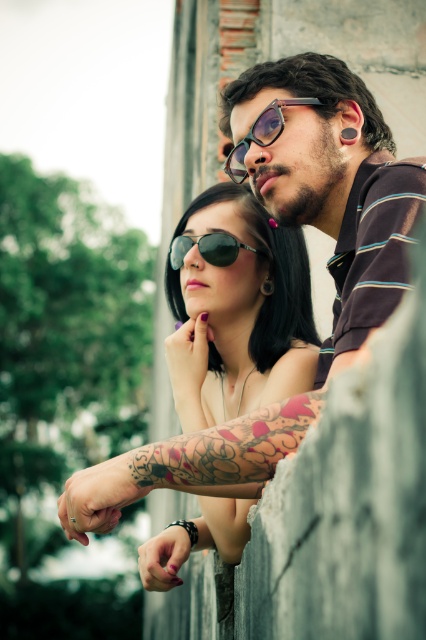
Between matte black sunglasses at upper center and matte black sunglasses at center, which one is positioned higher?

matte black sunglasses at upper center is above.

Does matte black sunglasses at upper center have a lesser width compared to matte black sunglasses at center?

No, matte black sunglasses at upper center is not thinner than matte black sunglasses at center.

Identify the location of matte black sunglasses at upper center. This screenshot has height=640, width=426. (328, 266).

Measure the distance between matte black sunglasses at upper center and matte black glasses at center.

matte black sunglasses at upper center is 18.33 inches away from matte black glasses at center.

What do you see at coordinates (328, 266) in the screenshot?
I see `matte black sunglasses at upper center` at bounding box center [328, 266].

Locate an element on the screen. Image resolution: width=426 pixels, height=640 pixels. matte black sunglasses at upper center is located at coordinates (328, 266).

Is matte black glasses at center positioned in front of black matte sunglasses at center?

Yes, matte black glasses at center is in front of black matte sunglasses at center.

Is matte black glasses at center taller than black matte sunglasses at center?

Correct, matte black glasses at center is much taller as black matte sunglasses at center.

Which is behind, point (258, 122) or point (209, 248)?

Positioned behind is point (209, 248).

This screenshot has width=426, height=640. I want to click on matte black glasses at center, so click(262, 132).